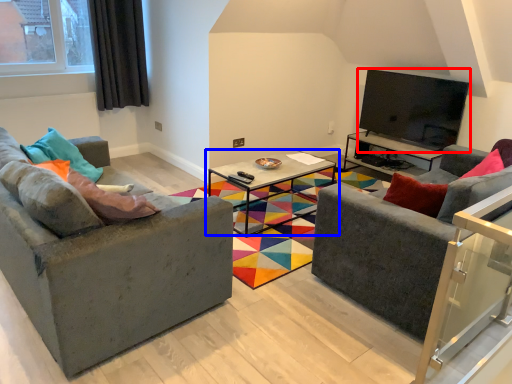
Question: Which of the following is the farthest to the observer, television (highlighted by a red box) or coffee table (highlighted by a blue box)?

Choices:
 (A) television
 (B) coffee table

Answer: (A)